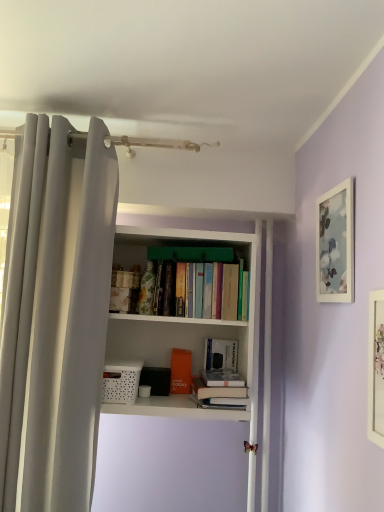
Where is `free space above white fabric curtain at left (from a real-world perspective)`? free space above white fabric curtain at left (from a real-world perspective) is located at coordinates (76, 111).